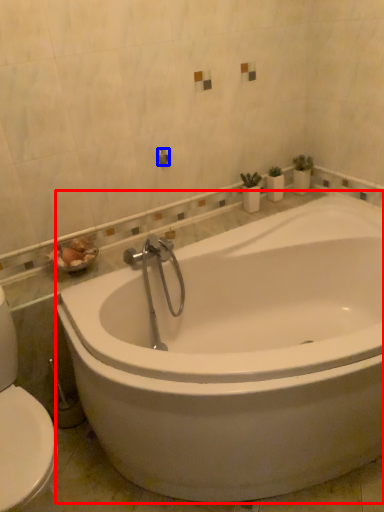
Question: Among these objects, which one is farthest to the camera, bathtub (highlighted by a red box) or shower (highlighted by a blue box)?

Choices:
 (A) bathtub
 (B) shower

Answer: (B)